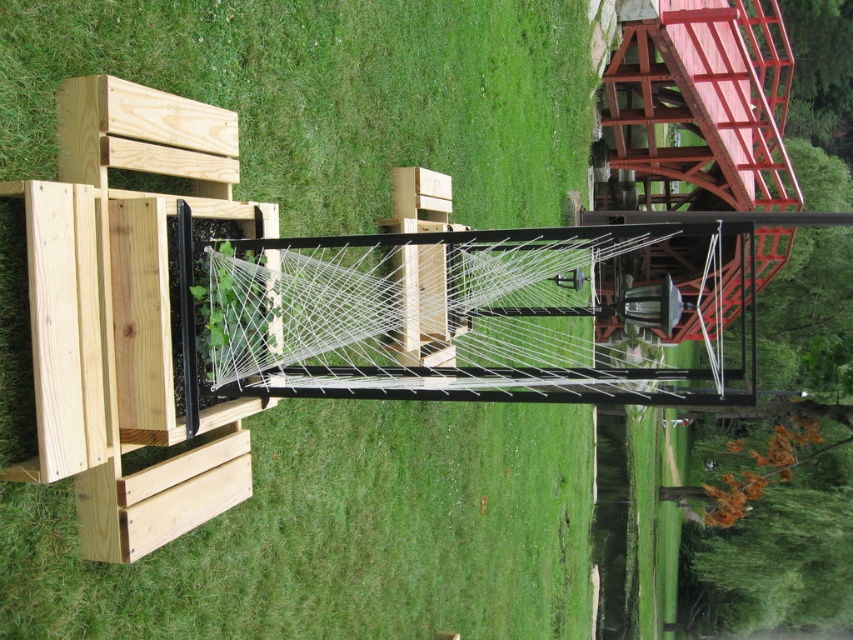
You are standing on the wooden walkway and want to see the green grass at center. Which direction should you look relative to the black metal rail at center?

The green grass at center is below the black metal rail at center, so you should look downward towards the green grass at center below the black metal rail at center.

From the picture: You are standing at the wooden structure and want to walk towards the point labeled as point (242, 384). Will you pass by point (576, 120) before reaching your destination?

No, because point (576, 120) is behind point (242, 384), so you would reach point (242, 384) first without passing through point (576, 120).